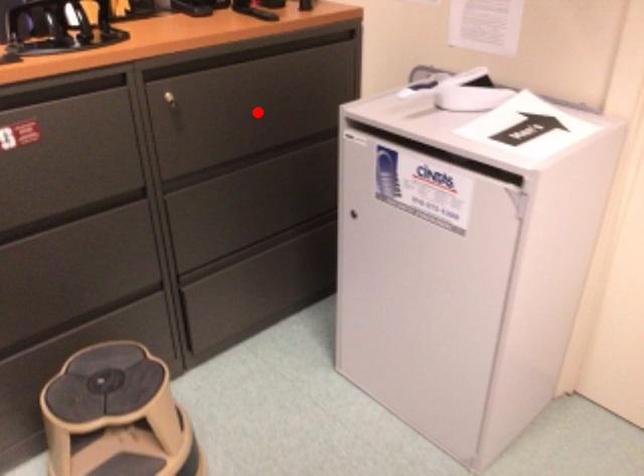
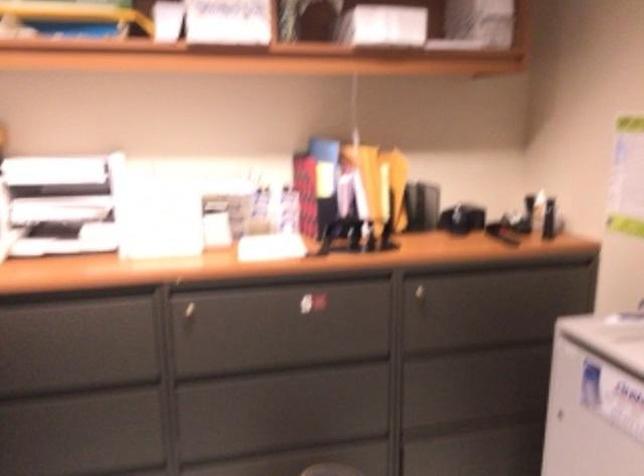
Question: A red point is marked in image1. In image2, is the corresponding 3D point closer to the camera or farther? Reply with the corresponding letter.

Choices:
 (A) The corresponding 3D point is closer.
 (B) The corresponding 3D point is farther.

Answer: (B)